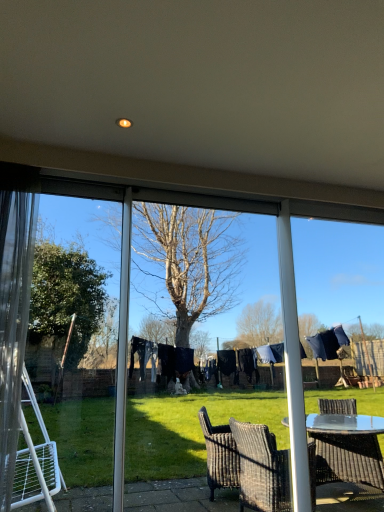
The image size is (384, 512). In order to click on blank space above transparent plastic screen door at center, which ranks as the 1th screen door in right-to-left order (from a real-world perspective) in this screenshot , I will do `click(203, 202)`.